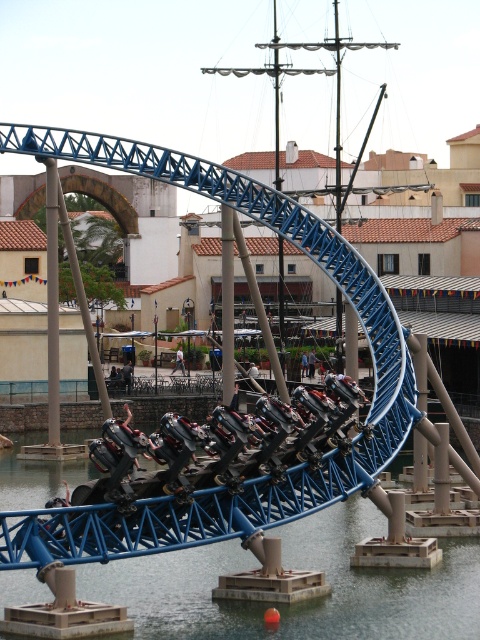
Question: Can you confirm if dark gray fabric jacket at center is positioned below light brown wooden chair at center?

Choices:
 (A) no
 (B) yes

Answer: (B)

Question: Considering the real-world distances, which object is closest to the light blue jeans at center?

Choices:
 (A) blue metallic waterway at center
 (B) light brown wooden chair at center
 (C) dark gray fabric jacket at center

Answer: (C)

Question: Estimate the real-world distances between objects in this image. Which object is farther from the blue metallic waterway at center?

Choices:
 (A) light blue jeans at center
 (B) dark gray fabric jacket at center
 (C) light brown wooden chair at center
 (D) blue jeans at center

Answer: (D)

Question: Is blue metallic waterway at center closer to camera compared to dark gray fabric jacket at center?

Choices:
 (A) yes
 (B) no

Answer: (A)

Question: Can you confirm if blue metallic waterway at center is positioned to the right of light blue jeans at center?

Choices:
 (A) yes
 (B) no

Answer: (A)

Question: Which object is farther from the camera taking this photo?

Choices:
 (A) light blue jeans at center
 (B) blue metallic waterway at center
 (C) blue jeans at center

Answer: (A)